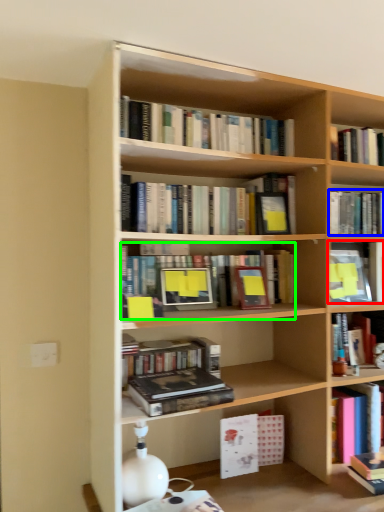
Question: Which object is positioned farthest from book (highlighted by a red box)? Select from book (highlighted by a blue box) and book (highlighted by a green box).

Choices:
 (A) book
 (B) book

Answer: (B)